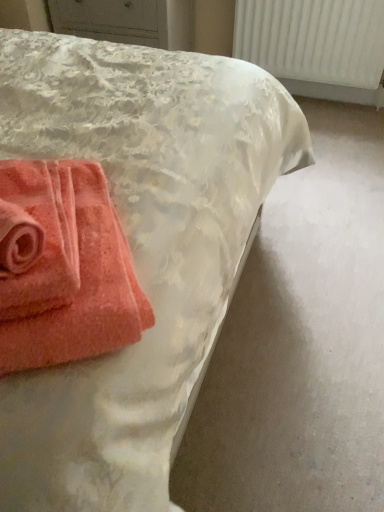
Question: Does coral soft towel at lower left, which is the first towel from left to right, have a lesser width compared to white textured radiator at upper right?

Choices:
 (A) yes
 (B) no

Answer: (B)

Question: From the image's perspective, would you say coral soft towel at lower left, which is the first towel from left to right, is shown under white textured radiator at upper right?

Choices:
 (A) yes
 (B) no

Answer: (A)

Question: Is white textured radiator at upper right at the back of coral soft towel at lower left, which is the first towel from left to right?

Choices:
 (A) yes
 (B) no

Answer: (B)

Question: Could white textured radiator at upper right be considered to be inside coral soft towel at lower left, which is the first towel from left to right?

Choices:
 (A) no
 (B) yes

Answer: (A)

Question: Is coral soft towel at lower left, positioned as the 2th towel in right-to-left order, not within white textured radiator at upper right?

Choices:
 (A) yes
 (B) no

Answer: (A)

Question: Choose the correct answer: Is coral soft towel at lower left, positioned as the 2th towel in right-to-left order, inside white textured radiator at upper right or outside it?

Choices:
 (A) outside
 (B) inside

Answer: (A)

Question: Is coral soft towel at lower left, positioned as the 2th towel in right-to-left order, taller or shorter than white textured radiator at upper right?

Choices:
 (A) tall
 (B) short

Answer: (B)

Question: From the image's perspective, is coral soft towel at lower left, positioned as the 2th towel in right-to-left order, positioned above or below white textured radiator at upper right?

Choices:
 (A) below
 (B) above

Answer: (A)

Question: Is coral soft towel at lower left, which is the first towel from left to right, in front of or behind white textured radiator at upper right in the image?

Choices:
 (A) front
 (B) behind

Answer: (A)

Question: In terms of height, does coral terry cloth towel at lower left, the 2th towel from the left, look taller or shorter compared to white textured radiator at upper right?

Choices:
 (A) tall
 (B) short

Answer: (B)

Question: In terms of size, does coral terry cloth towel at lower left, the 2th towel from the left, appear bigger or smaller than white textured radiator at upper right?

Choices:
 (A) big
 (B) small

Answer: (B)

Question: Is point (115, 279) positioned closer to the camera than point (279, 17)?

Choices:
 (A) closer
 (B) farther

Answer: (A)

Question: From a real-world perspective, is coral terry cloth towel at lower left, marked as the first towel in a right-to-left arrangement, positioned above or below white textured radiator at upper right?

Choices:
 (A) above
 (B) below

Answer: (A)

Question: In the image, is white textured radiator at upper right on the left side or the right side of coral terry cloth towel at lower left, marked as the first towel in a right-to-left arrangement?

Choices:
 (A) left
 (B) right

Answer: (B)

Question: Considering the positions of white textured radiator at upper right and coral terry cloth towel at lower left, marked as the first towel in a right-to-left arrangement, in the image, is white textured radiator at upper right wider or thinner than coral terry cloth towel at lower left, marked as the first towel in a right-to-left arrangement,?

Choices:
 (A) wide
 (B) thin

Answer: (B)